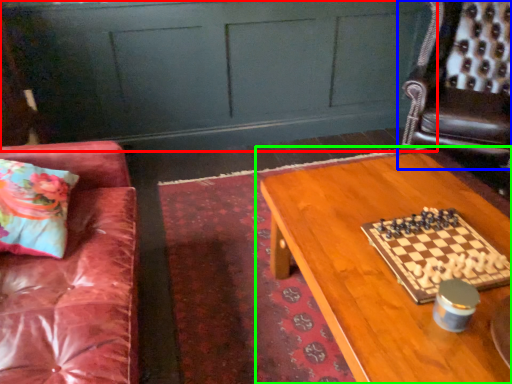
Question: Which is nearer to the dresser (highlighted by a red box)? chair (highlighted by a blue box) or table (highlighted by a green box).

Choices:
 (A) chair
 (B) table

Answer: (A)